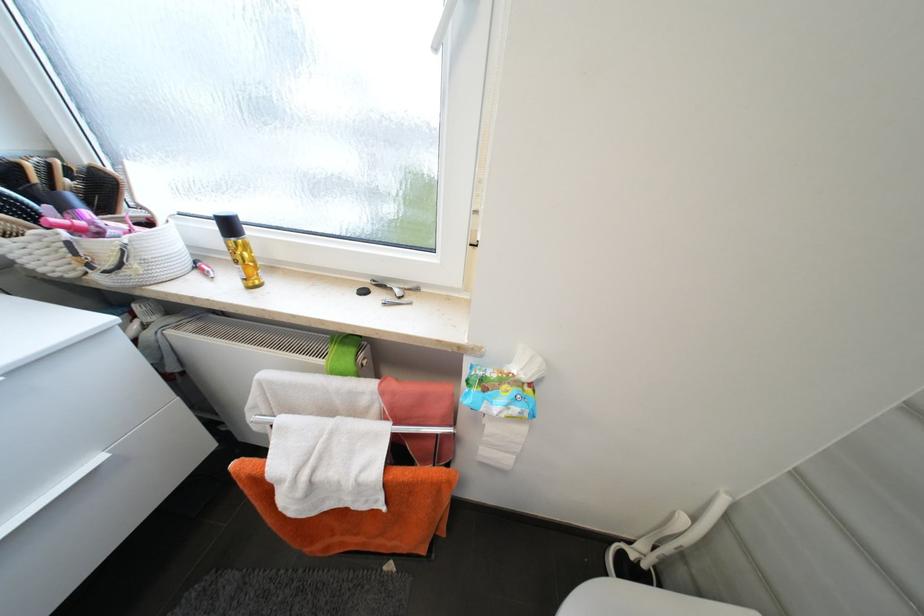
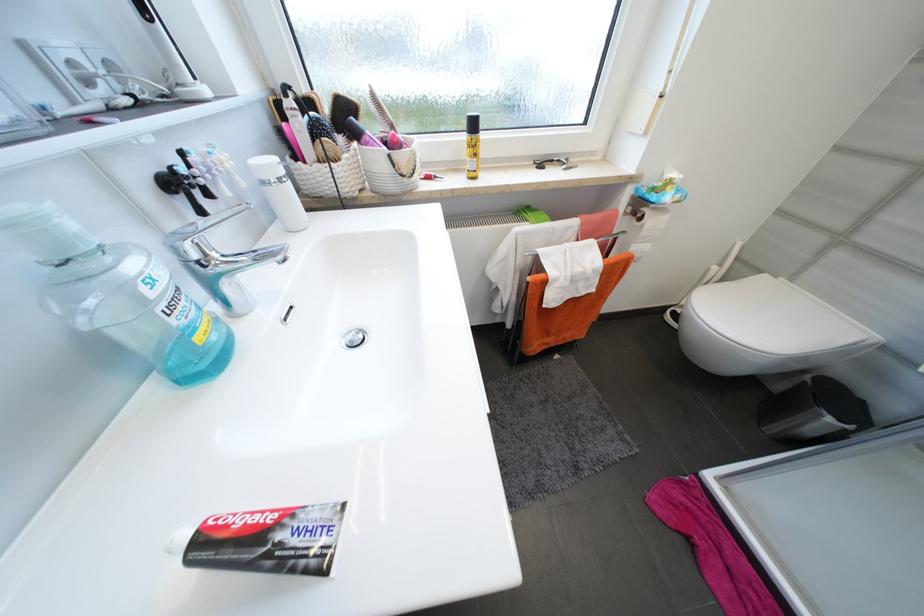
The point at (x=64, y=156) is marked in the first image. Where is the corresponding point in the second image?

(280, 92)